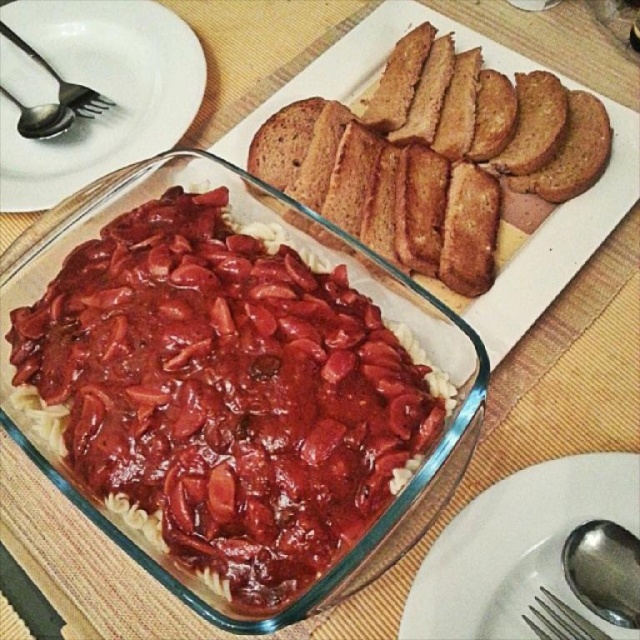
Question: Which point is closer to the camera?

Choices:
 (A) silver metallic spoon at upper left
 (B) silver metallic fork at lower right

Answer: (B)

Question: Does white ceramic plate at upper left have a lesser width compared to silver metallic spoon at upper left?

Choices:
 (A) yes
 (B) no

Answer: (B)

Question: Which of these objects is positioned closest to the silver metallic spoon at upper left?

Choices:
 (A) shiny glass casserole at center
 (B) white ceramic plate at upper left

Answer: (B)

Question: From the image, what is the correct spatial relationship of shiny glass casserole at center in relation to silver metallic spoon at upper left?

Choices:
 (A) right
 (B) left

Answer: (A)

Question: Estimate the real-world distances between objects in this image. Which object is closer to the brushed metal fork at upper left?

Choices:
 (A) translucent glass casserole dish at center
 (B) white glossy plate at center
 (C) silver metallic spoon at upper left

Answer: (C)

Question: Does translucent glass casserole dish at center lie in front of silver metallic fork at lower right?

Choices:
 (A) no
 (B) yes

Answer: (A)